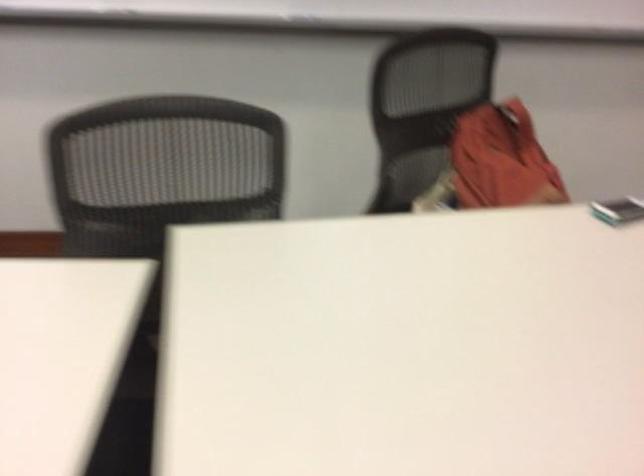
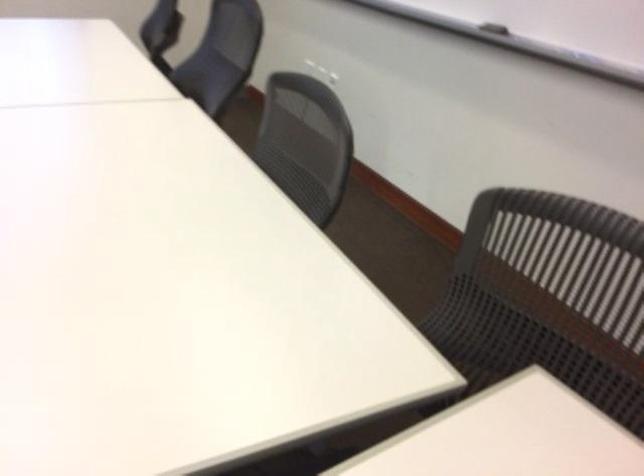
Question: The camera is either moving clockwise (left) or counter-clockwise (right) around the object. The first image is from the beginning of the video and the second image is from the end. Is the camera moving left or right when shooting the video?

Choices:
 (A) Left
 (B) Right

Answer: (B)